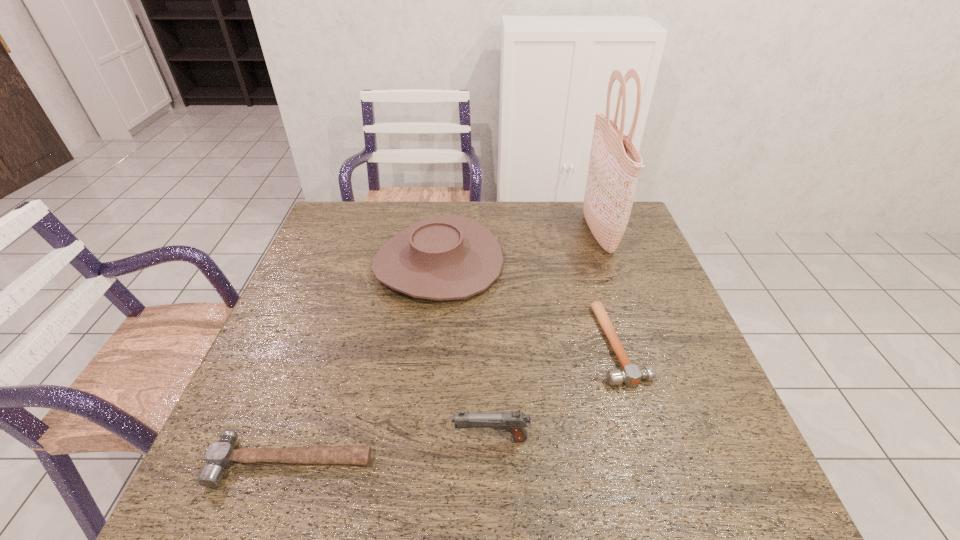
Identify the location of free space located on the right of the farther hammer. This screenshot has height=540, width=960. (683, 344).

Where is `shopping bag located in the far edge section of the desktop`? The image size is (960, 540). shopping bag located in the far edge section of the desktop is located at coordinates coord(614,166).

This screenshot has height=540, width=960. Find the location of `cowboy hat present at the far edge`. cowboy hat present at the far edge is located at coordinates (449, 257).

Where is `object at the near edge`? This screenshot has height=540, width=960. object at the near edge is located at coordinates (221, 454).

The image size is (960, 540). In order to click on object that is at the left edge in this screenshot , I will do `click(221, 454)`.

I want to click on shopping bag that is at the right edge, so click(614, 166).

Locate an element on the screen. hammer at the right edge is located at coordinates (631, 375).

This screenshot has height=540, width=960. I want to click on object located in the near left corner section of the desktop, so click(x=221, y=454).

Identify the location of object at the far right corner. (614, 166).

This screenshot has height=540, width=960. In the image, there is a desktop. What are the coordinates of `vacant region at the far edge` in the screenshot? It's located at (533, 212).